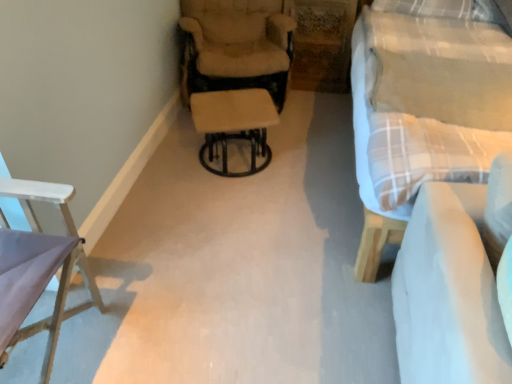
At what (x,y) coordinates should I click in order to perform the action: click on free spot in front of beige fabric chair at center, placed as the second chair when sorted from bottom to top. Please return your answer as a coordinate pair (x, y). This screenshot has width=512, height=384. Looking at the image, I should click on (248, 142).